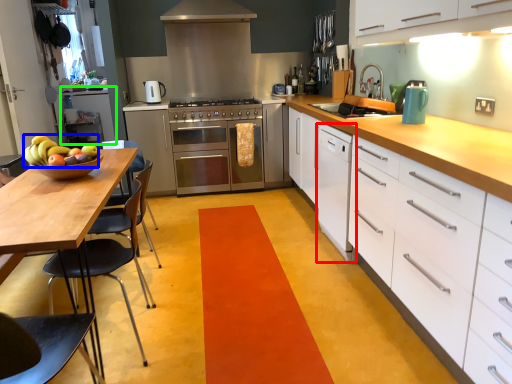
Question: Which object is the farthest from file cabinet (highlighted by a red box)? Choose among these: fruit (highlighted by a blue box) or cabinetry (highlighted by a green box).

Choices:
 (A) fruit
 (B) cabinetry

Answer: (B)